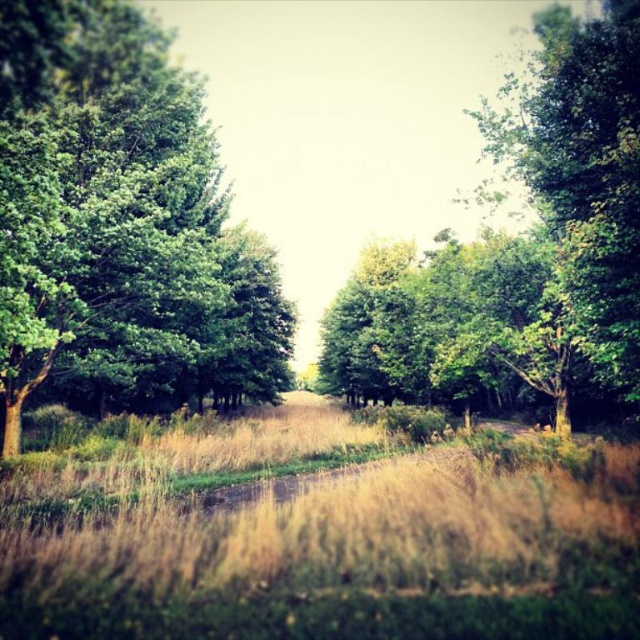
You are standing on the dirt path in the middle of the scene. Looking towards the green leafy tree at left and the green leafy tree at center, which tree appears closer to you?

The green leafy tree at left appears closer because it is in front of the green leafy tree at center.

You are standing at the starting point of the dirt path in the rural scene. You notice the dry grass at center. Based on its coordinates, where exactly is the dry grass located relative to your position?

The dry grass at center is located at coordinates point (323, 538), which means it is positioned slightly to the right and halfway up the vertical axis from your starting point on the dirt path.

You are a hiker trying to cross the path in the image. The dry grass at center and the green leafy tree at left are in your way. Which one is wider so you can decide which to avoid first?

The dry grass at center is wider than the green leafy tree at left, so you should avoid the dry grass at center first.